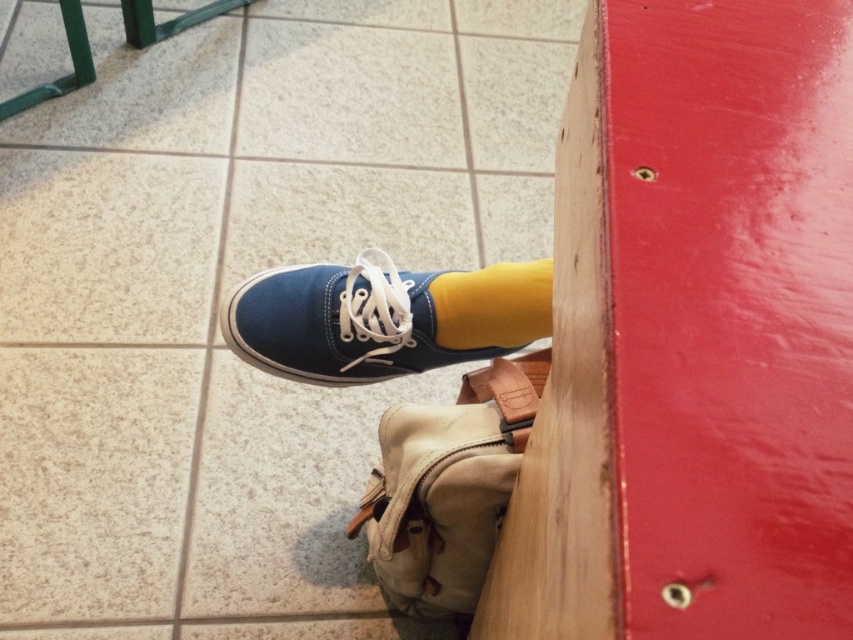
Is blue canvas shoe at center to the left of yellow cotton sock at center from the viewer's perspective?

Correct, you'll find blue canvas shoe at center to the left of yellow cotton sock at center.

Which is behind, point (543, 317) or point (535, 282)?

The point (543, 317) is more distant.

Identify the location of blue canvas shoe at center. (381, 317).